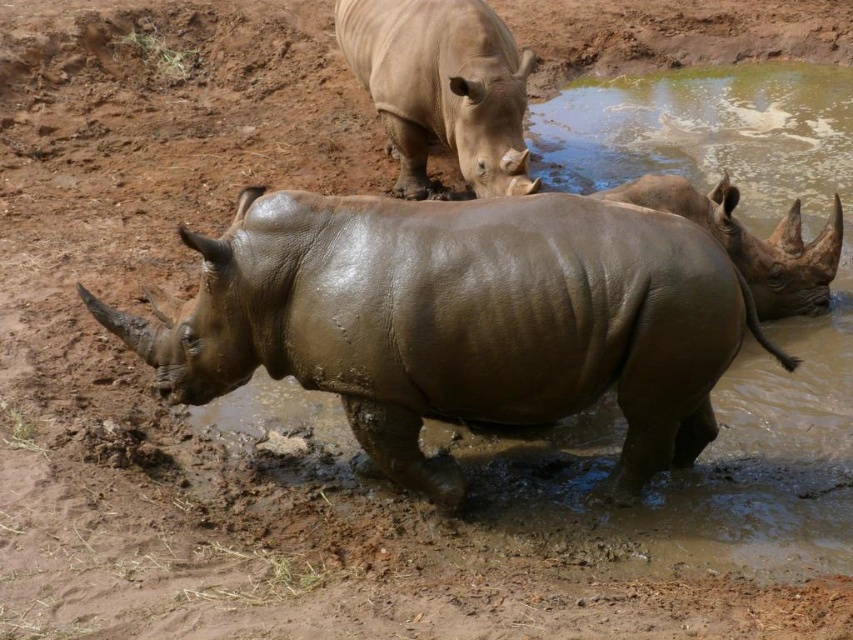
Is muddy brown rhinoceros at center smaller than matte brown rhinoceros at center?

No, muddy brown rhinoceros at center is not smaller than matte brown rhinoceros at center.

Is muddy brown rhinoceros at center positioned behind matte brown rhinoceros at center?

No, it is not.

Is point (495, 408) farther from camera compared to point (772, 253)?

No, (495, 408) is closer to viewer.

Locate an element on the screen. The width and height of the screenshot is (853, 640). muddy brown rhinoceros at center is located at coordinates (461, 320).

Does point (447, 284) come closer to viewer compared to point (427, 125)?

Yes, point (447, 284) is in front of point (427, 125).

Is muddy brown rhinoceros at center positioned behind smooth beige rhino at upper center?

No.

Is point (325, 288) behind point (474, 124)?

No, it is in front of (474, 124).

You are a GUI agent. You are given a task and a screenshot of the screen. Output one action in this format:
    pyautogui.click(x=<x>, y=<y>)
    Task: Click on the muddy brown rhinoceros at center
    Image resolution: width=853 pixels, height=640 pixels.
    Given the screenshot: What is the action you would take?
    pyautogui.click(x=461, y=320)

Does smooth beige rhino at upper center have a greater width compared to matte brown rhinoceros at center?

No, smooth beige rhino at upper center is not wider than matte brown rhinoceros at center.

Who is taller, smooth beige rhino at upper center or matte brown rhinoceros at center?

Standing taller between the two is smooth beige rhino at upper center.

Locate an element on the screen. This screenshot has width=853, height=640. smooth beige rhino at upper center is located at coordinates (442, 88).

Find the location of `smooth beige rhino at upper center`. smooth beige rhino at upper center is located at coordinates (442, 88).